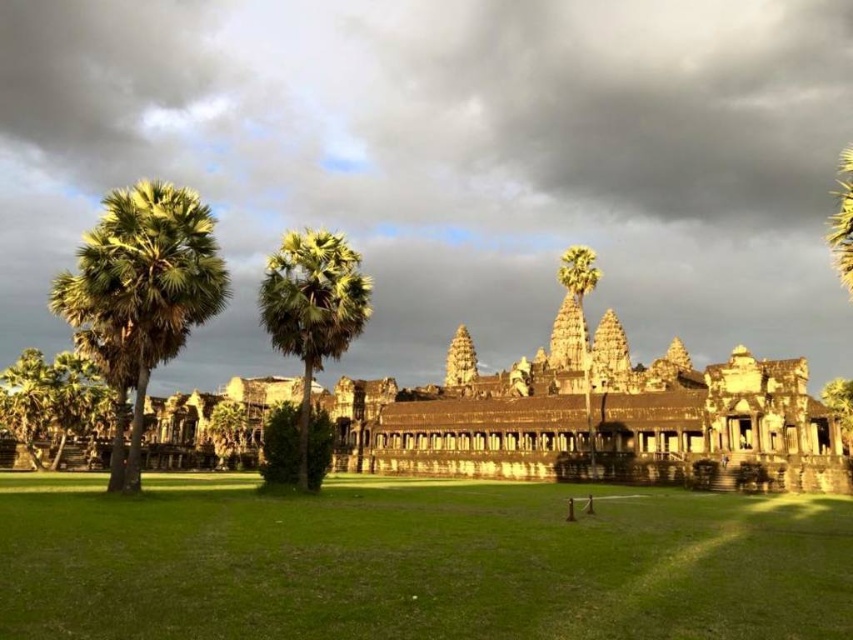
You are a photographer planning to capture the Angkor Wat temple with both the green leafy palm tree at left and the green leafy palm tree at center in the frame. Which palm tree should you position closer to the camera to ensure both are in focus?

You should position the green leafy palm tree at left closer to the camera because it is much taller than the green leafy palm tree at center, ensuring both are in focus.

Consider the image. You are a photographer planning to capture a wide shot of the temple while including both the green leafy palm tree at left and the green leafy bush at center in your frame. Which object should you position closer to the edge of the frame to ensure both are fully visible?

You should position the green leafy palm tree at left closer to the edge of the frame since it is wider than the green leafy bush at center, allowing more space for the narrower bush in the center.